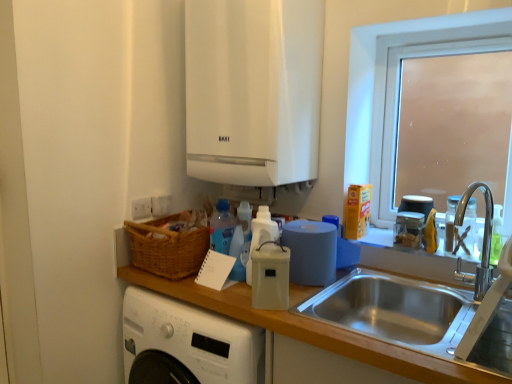
Locate an element on the screen. The image size is (512, 384). vacant area situated to the left side of translucent glass jar at upper right, which ranks as the first appliance in right-to-left order is located at coordinates (377, 240).